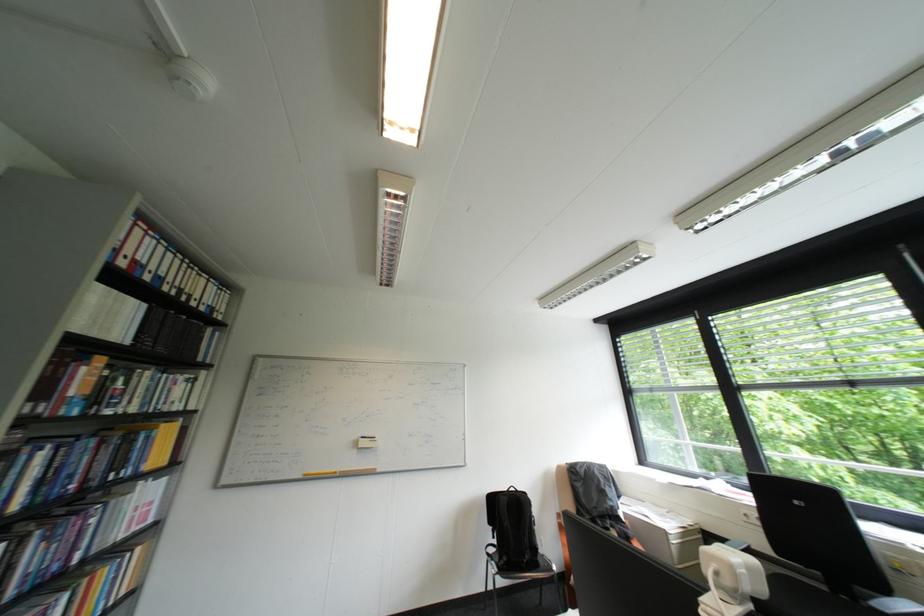
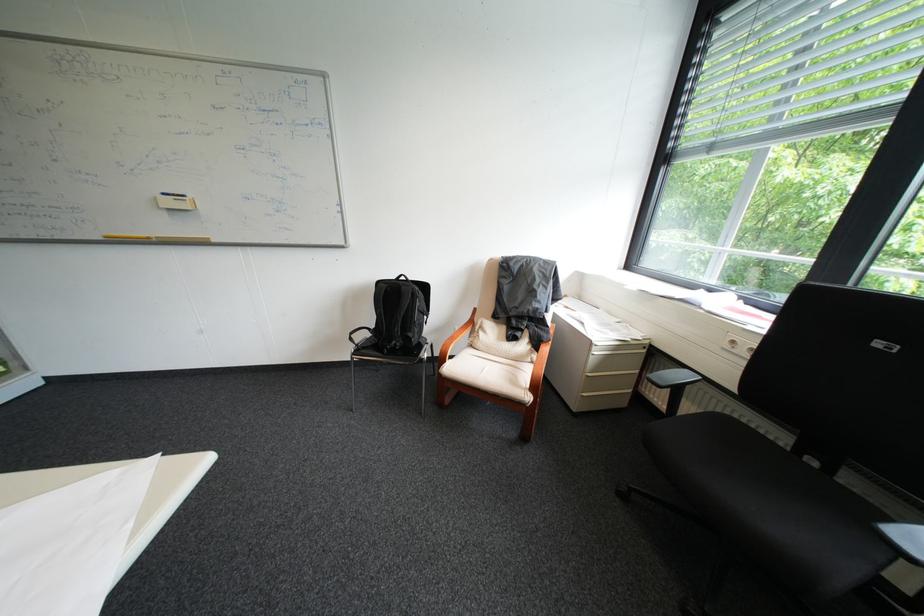
Locate, in the second image, the point that corresponds to (x=759, y=516) in the first image.

(746, 342)